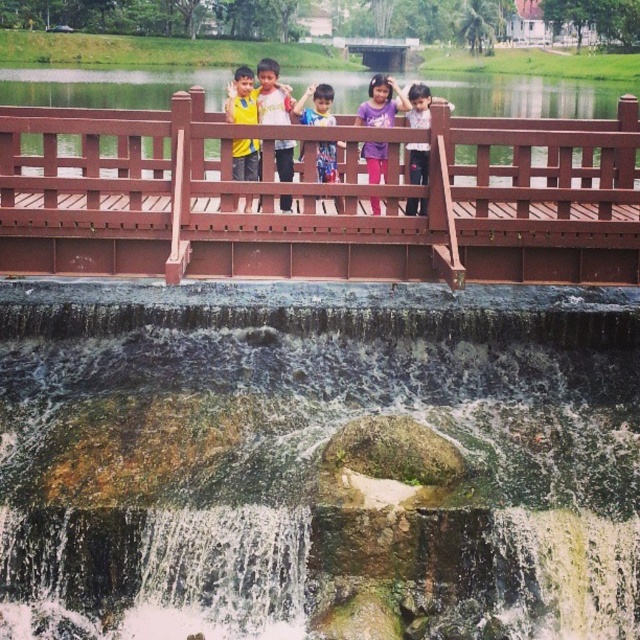
Is brown wooden bridge at center positioned before multicolored shirt at center?

Yes, it is in front of multicolored shirt at center.

Which is in front, point (65, 182) or point (330, 172)?

Point (65, 182)

Who is more forward, (x=358, y=132) or (x=321, y=150)?

Positioned in front is point (x=358, y=132).

Identify the location of brown wooden bridge at center. (317, 198).

Who is lower down, white matte shirt at center or matte white shirt at center?

Positioned lower is matte white shirt at center.

Is point (280, 115) farther from viewer compared to point (422, 148)?

Yes, point (280, 115) is behind point (422, 148).

Who is more forward, (260, 80) or (419, 202)?

Positioned in front is point (419, 202).

This screenshot has width=640, height=640. In order to click on white matte shirt at center in this screenshot , I will do `click(273, 93)`.

Is the position of brown wooden bridge at center less distant than that of purple cotton shirt at center?

Yes.

Does brown wooden bridge at center appear on the right side of purple cotton shirt at center?

Incorrect, brown wooden bridge at center is not on the right side of purple cotton shirt at center.

This screenshot has width=640, height=640. Identify the location of brown wooden bridge at center. (317, 198).

Identify the location of brown wooden bridge at center. The image size is (640, 640). (317, 198).